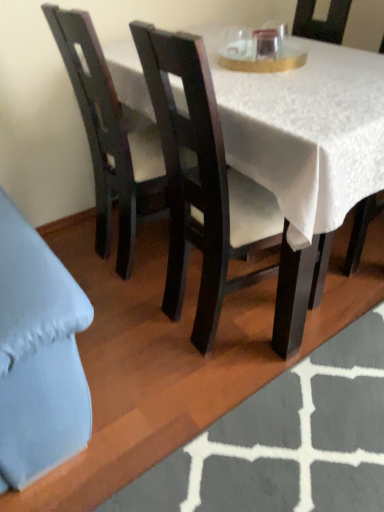
Question: Is matte black chair at center, which is counted as the first chair, starting from the right, to the right of white textured rug at lower center from the viewer's perspective?

Choices:
 (A) no
 (B) yes

Answer: (B)

Question: Can you confirm if matte black chair at center, which is counted as the first chair, starting from the right, is smaller than white textured rug at lower center?

Choices:
 (A) yes
 (B) no

Answer: (B)

Question: Is matte black chair at center, which is the third chair from left to right, surrounding white textured rug at lower center?

Choices:
 (A) yes
 (B) no

Answer: (B)

Question: Is the position of matte black chair at center, which is the third chair from left to right, less distant than that of white textured rug at lower center?

Choices:
 (A) no
 (B) yes

Answer: (A)

Question: Is matte black chair at center, which is the third chair from left to right, far away from white textured rug at lower center?

Choices:
 (A) yes
 (B) no

Answer: (A)

Question: In terms of size, does matte dark wood chair at center, which is the 2th chair in right-to-left order, appear bigger or smaller than dark wood chair at left, the first chair viewed from the left?

Choices:
 (A) small
 (B) big

Answer: (B)

Question: Would you say matte dark wood chair at center, which is the 2th chair in left-to-right order, is to the left or to the right of dark wood chair at left, the first chair viewed from the left, in the picture?

Choices:
 (A) left
 (B) right

Answer: (B)

Question: In the image, is matte dark wood chair at center, which is the 2th chair in right-to-left order, positioned in front of or behind dark wood chair at left, which is the third chair in right-to-left order?

Choices:
 (A) behind
 (B) front

Answer: (B)

Question: From the image's perspective, relative to dark wood chair at left, the first chair viewed from the left, is matte dark wood chair at center, which is the 2th chair in left-to-right order, above or below?

Choices:
 (A) below
 (B) above

Answer: (A)

Question: Is dark wood chair at left, which is the third chair in right-to-left order, bigger or smaller than transparent glass at upper center?

Choices:
 (A) small
 (B) big

Answer: (B)

Question: Is dark wood chair at left, which is the third chair in right-to-left order, in front of or behind transparent glass at upper center in the image?

Choices:
 (A) front
 (B) behind

Answer: (A)

Question: From a real-world perspective, is dark wood chair at left, which is the third chair in right-to-left order, physically located above or below transparent glass at upper center?

Choices:
 (A) above
 (B) below

Answer: (B)

Question: Considering the positions of dark wood chair at left, which is the third chair in right-to-left order, and transparent glass at upper center in the image, is dark wood chair at left, which is the third chair in right-to-left order, taller or shorter than transparent glass at upper center?

Choices:
 (A) tall
 (B) short

Answer: (A)

Question: Is point (362, 218) positioned closer to the camera than point (148, 177)?

Choices:
 (A) farther
 (B) closer

Answer: (A)

Question: Would you say matte black chair at center, which is counted as the first chair, starting from the right, is to the left or to the right of dark wood chair at left, the first chair viewed from the left, in the picture?

Choices:
 (A) right
 (B) left

Answer: (A)